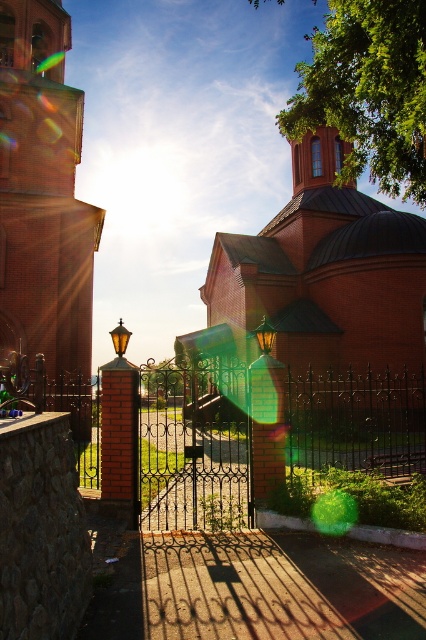
Question: Among these points, which one is farthest from the camera?

Choices:
 (A) (5, 161)
 (B) (379, 480)
 (C) (371, 314)

Answer: (C)

Question: Which point is closer to the camera?

Choices:
 (A) [210, 380]
 (B) [348, 230]

Answer: (B)

Question: Considering the real-world distances, which object is farthest from the black wrought iron gate at center?

Choices:
 (A) red brick church at center
 (B) brick tower at left

Answer: (B)

Question: Is black wrought iron gate at center bigger than brick tower at left?

Choices:
 (A) no
 (B) yes

Answer: (B)

Question: From the image, what is the correct spatial relationship of black wrought iron gate at center in relation to brick tower at left?

Choices:
 (A) below
 (B) above

Answer: (A)

Question: Does black wrought iron gate at center appear under red brick church at center?

Choices:
 (A) no
 (B) yes

Answer: (B)